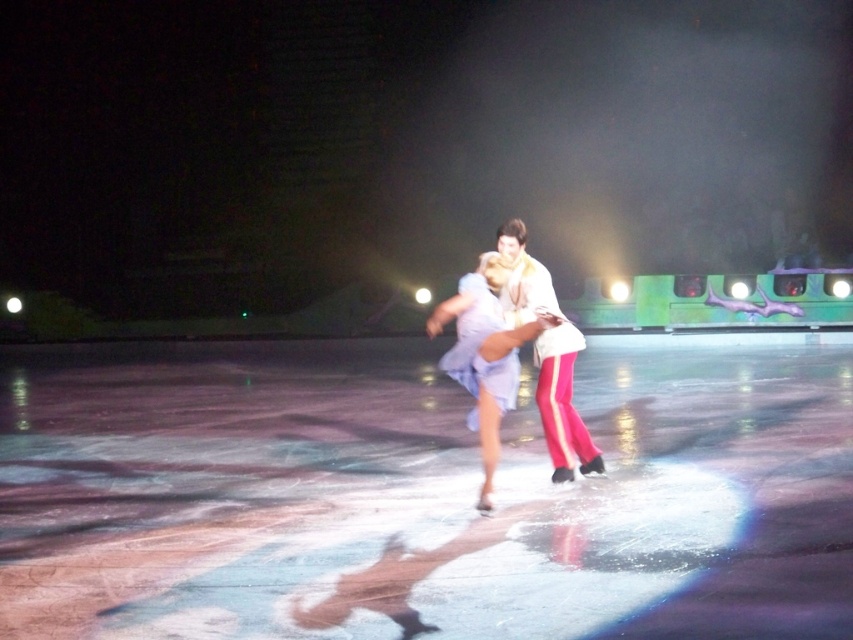
Is point (746, 618) positioned before point (473, 307)?

That is True.

The width and height of the screenshot is (853, 640). Identify the location of glossy ice skating rink at center. (418, 497).